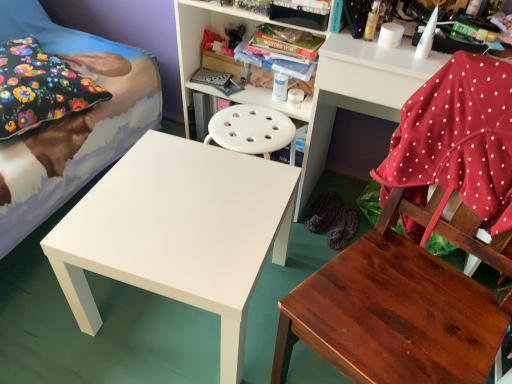
Image resolution: width=512 pixels, height=384 pixels. I want to click on free space above white matte table at center (from a real-world perspective), so click(x=189, y=201).